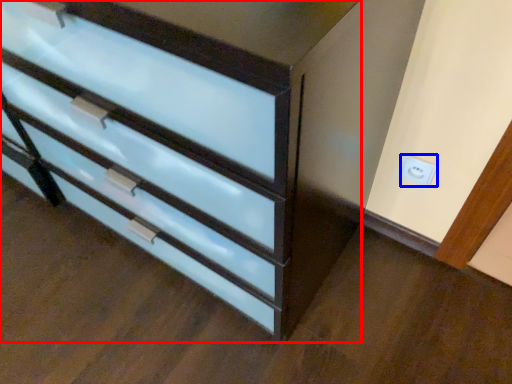
Question: Among these objects, which one is nearest to the camera, chest of drawers (highlighted by a red box) or electric outlet (highlighted by a blue box)?

Choices:
 (A) chest of drawers
 (B) electric outlet

Answer: (A)